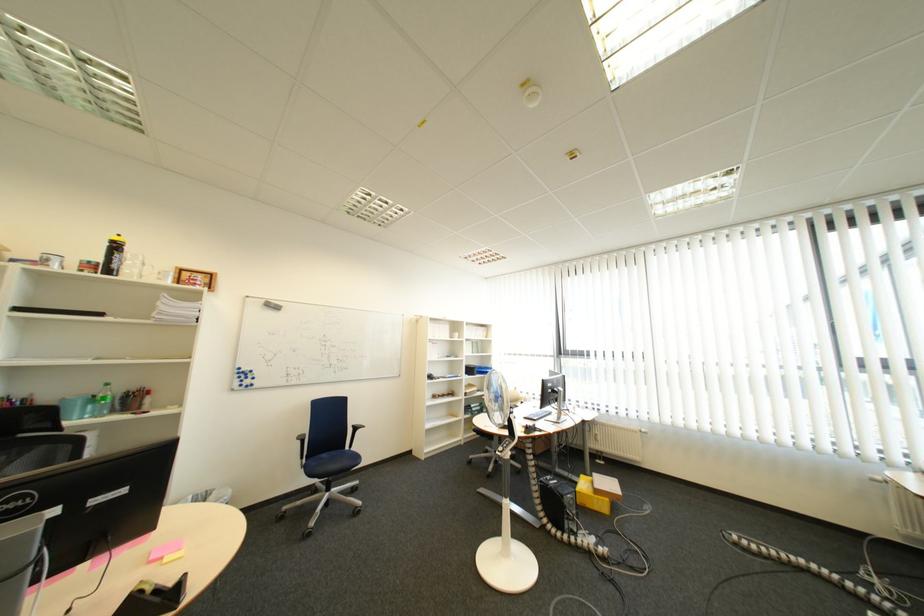
Image resolution: width=924 pixels, height=616 pixels. What do you see at coordinates (132, 265) in the screenshot?
I see `the glass mug handle` at bounding box center [132, 265].